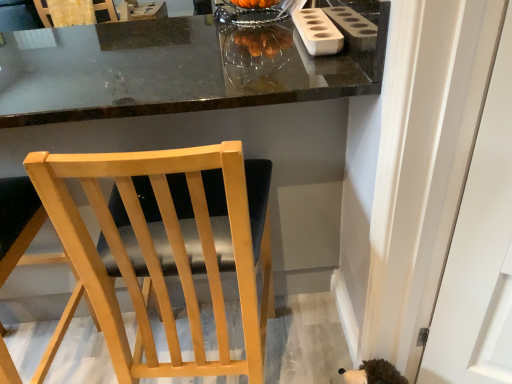
Question: Would you say white matte holder at upper right contains matte black table at center?

Choices:
 (A) no
 (B) yes

Answer: (A)

Question: Considering the relative positions of white matte holder at upper right and matte black table at center in the image provided, is white matte holder at upper right to the left of matte black table at center from the viewer's perspective?

Choices:
 (A) yes
 (B) no

Answer: (B)

Question: Is white matte holder at upper right not inside matte black table at center?

Choices:
 (A) no
 (B) yes

Answer: (A)

Question: Does white matte holder at upper right have a lesser width compared to matte black table at center?

Choices:
 (A) yes
 (B) no

Answer: (A)

Question: From a real-world perspective, is white matte holder at upper right positioned over matte black table at center based on gravity?

Choices:
 (A) no
 (B) yes

Answer: (B)

Question: From a real-world perspective, relative to wooden chair at upper left, which appears as the 3th chair when viewed from the right, is white matte holder at upper right vertically above or below?

Choices:
 (A) below
 (B) above

Answer: (B)

Question: Is white matte holder at upper right inside or outside of wooden chair at upper left, marked as the 3th chair in a front-to-back arrangement?

Choices:
 (A) outside
 (B) inside

Answer: (A)

Question: Does point (306, 13) appear closer or farther from the camera than point (105, 8)?

Choices:
 (A) closer
 (B) farther

Answer: (A)

Question: Considering the positions of white matte holder at upper right and wooden chair at upper left, the 1th chair viewed from the left, in the image, is white matte holder at upper right bigger or smaller than wooden chair at upper left, the 1th chair viewed from the left,?

Choices:
 (A) big
 (B) small

Answer: (B)

Question: Based on their positions, is matte black table at center located to the left or right of light wood chair at center, marked as the second chair in a front-to-back arrangement?

Choices:
 (A) left
 (B) right

Answer: (B)

Question: Relative to light wood chair at center, the second chair in the back-to-front sequence, is matte black table at center in front or behind?

Choices:
 (A) behind
 (B) front

Answer: (A)

Question: Is matte black table at center inside the boundaries of light wood chair at center, marked as the second chair in a front-to-back arrangement, or outside?

Choices:
 (A) inside
 (B) outside

Answer: (B)

Question: From their relative heights in the image, would you say matte black table at center is taller or shorter than light wood chair at center, marked as the second chair in a right-to-left arrangement?

Choices:
 (A) short
 (B) tall

Answer: (B)

Question: Considering their positions, is light wood chair at center, marked as the 1th chair in a front-to-back arrangement, located in front of or behind matte black table at center?

Choices:
 (A) front
 (B) behind

Answer: (A)

Question: Is point (178, 208) closer or farther from the camera than point (326, 187)?

Choices:
 (A) farther
 (B) closer

Answer: (B)